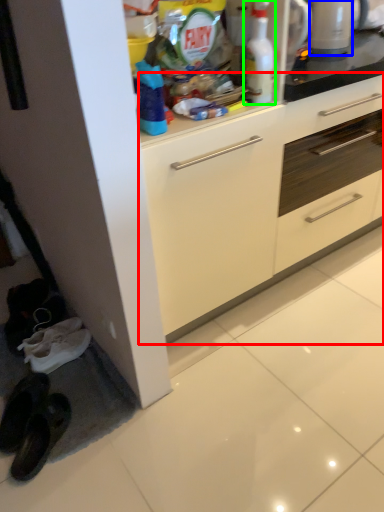
Question: Based on their relative distances, which object is farther from cabinetry (highlighted by a red box)? Choose from appliance (highlighted by a blue box) and cleaning product (highlighted by a green box).

Choices:
 (A) appliance
 (B) cleaning product

Answer: (A)